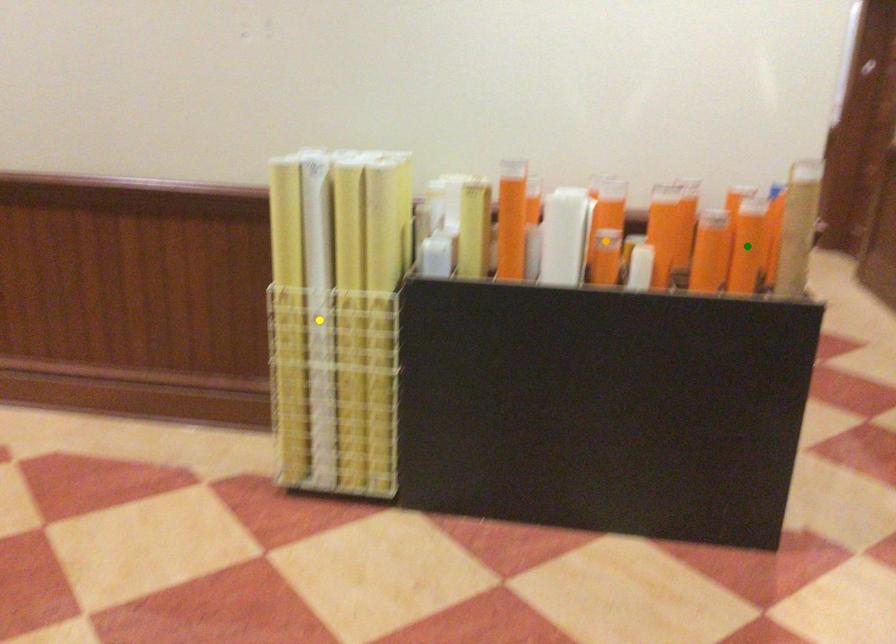
Order these from nearest to farthest:
orange point
yellow point
green point

1. yellow point
2. orange point
3. green point